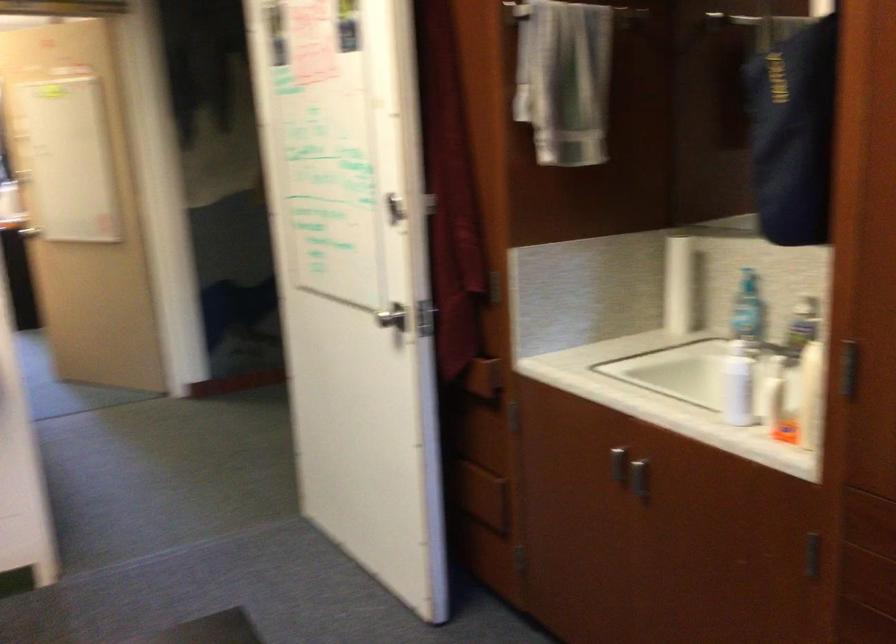
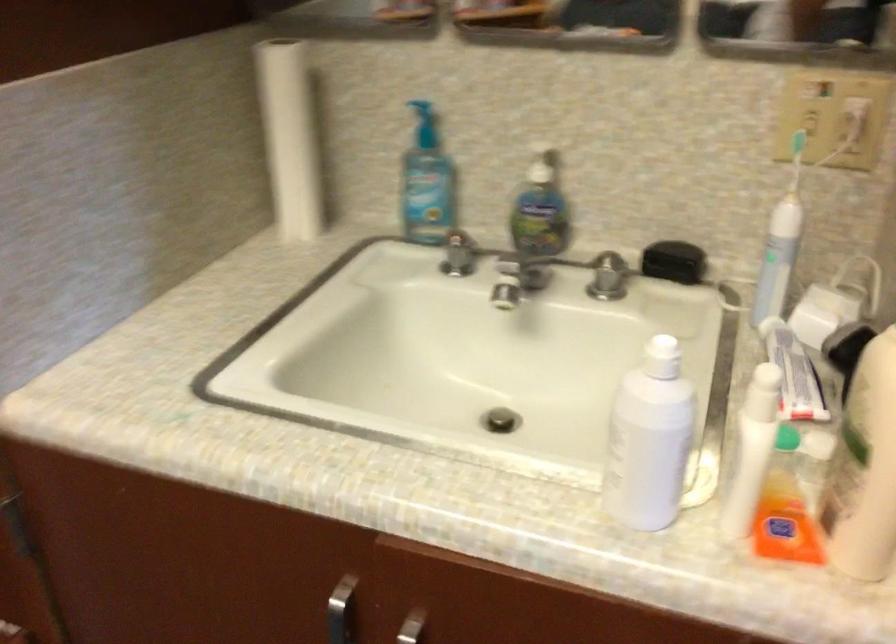
The point at [731,343] is marked in the first image. Where is the corresponding point in the second image?

(661, 357)